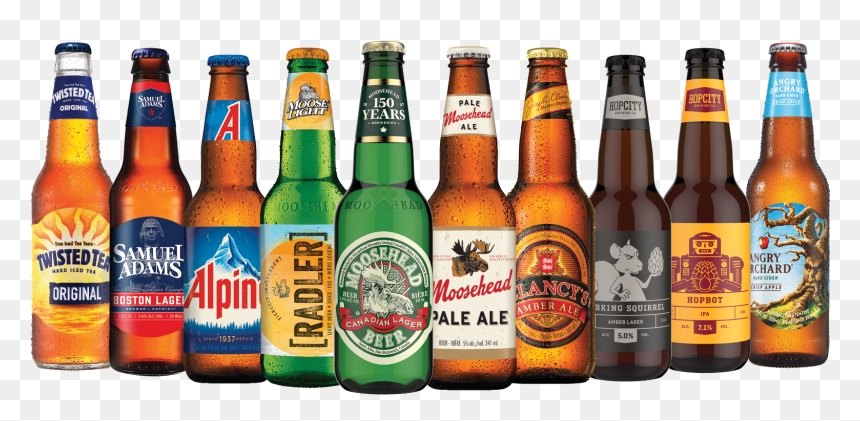
What are the coordinates of `glass bottle` in the screenshot? It's located at (64, 150), (157, 158), (228, 158), (295, 168), (382, 178), (469, 175), (541, 166), (625, 176), (710, 172), (785, 178).